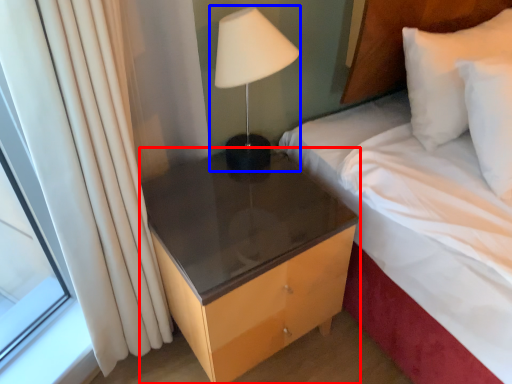
Question: Which of the following is the farthest to the observer, nightstand (highlighted by a red box) or bedside lamp (highlighted by a blue box)?

Choices:
 (A) nightstand
 (B) bedside lamp

Answer: (A)